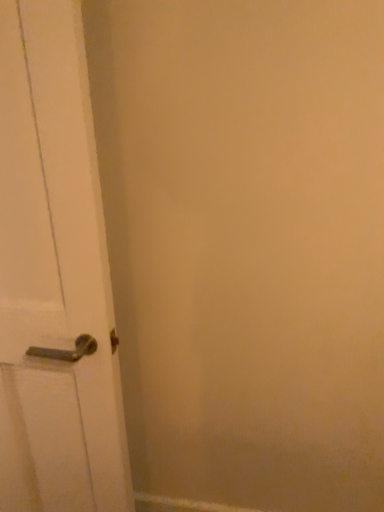
Measure the distance between white glossy door handle at left and camera.

white glossy door handle at left and camera are 29.27 inches apart from each other.

Describe the element at coordinates (54, 275) in the screenshot. The width and height of the screenshot is (384, 512). I see `white glossy door handle at left` at that location.

Image resolution: width=384 pixels, height=512 pixels. Find the location of `white glossy door handle at left`. white glossy door handle at left is located at coordinates (54, 275).

What are the coordinates of `white glossy door handle at left` in the screenshot? It's located at (54, 275).